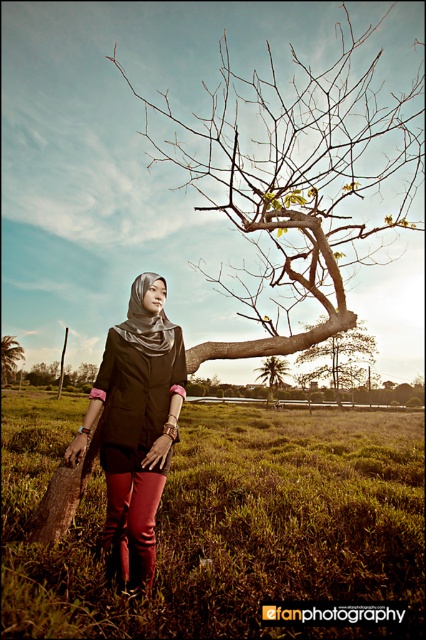
Question: Can you confirm if matte brown pants at center is positioned to the left of matte black hijab at center?

Choices:
 (A) no
 (B) yes

Answer: (A)

Question: Which object appears farthest from the camera in this image?

Choices:
 (A) brown textured tree at center
 (B) brown wood tree at center

Answer: (B)

Question: Is matte black hijab at center below brown wood tree at center?

Choices:
 (A) no
 (B) yes

Answer: (A)

Question: Which object is the closest to the brown wood tree at center?

Choices:
 (A) brown textured tree at center
 (B) brown wood tree at left
 (C) green leafy tree at center
 (D) matte black hijab at center

Answer: (C)

Question: Estimate the real-world distances between objects in this image. Which object is farther from the matte brown pants at center?

Choices:
 (A) brown textured tree at center
 (B) brown wood tree at center
 (C) green leafy tree at center
 (D) brown wood tree at left

Answer: (D)

Question: Can you confirm if brown wood tree at center is positioned above brown wood tree at left?

Choices:
 (A) no
 (B) yes

Answer: (B)